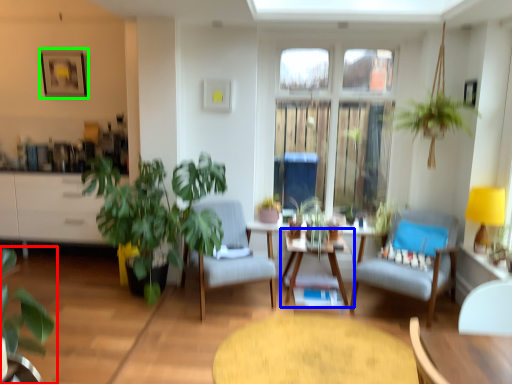
Question: Based on their relative distances, which object is nearer to houseplant (highlighted by a red box)? Choose from table (highlighted by a blue box) and picture frame (highlighted by a green box).

Choices:
 (A) table
 (B) picture frame

Answer: (A)